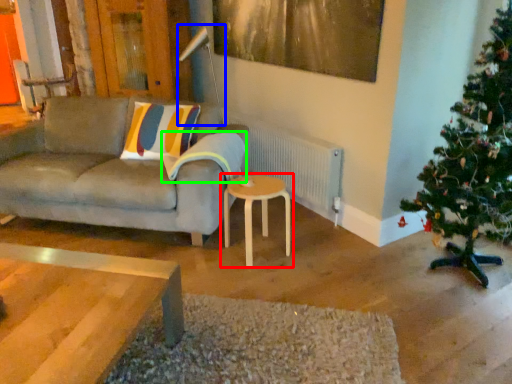
Question: Considering the real-world distances, which object is closest to table (highlighted by a red box)? lamp (highlighted by a blue box) or pillow (highlighted by a green box).

Choices:
 (A) lamp
 (B) pillow

Answer: (B)